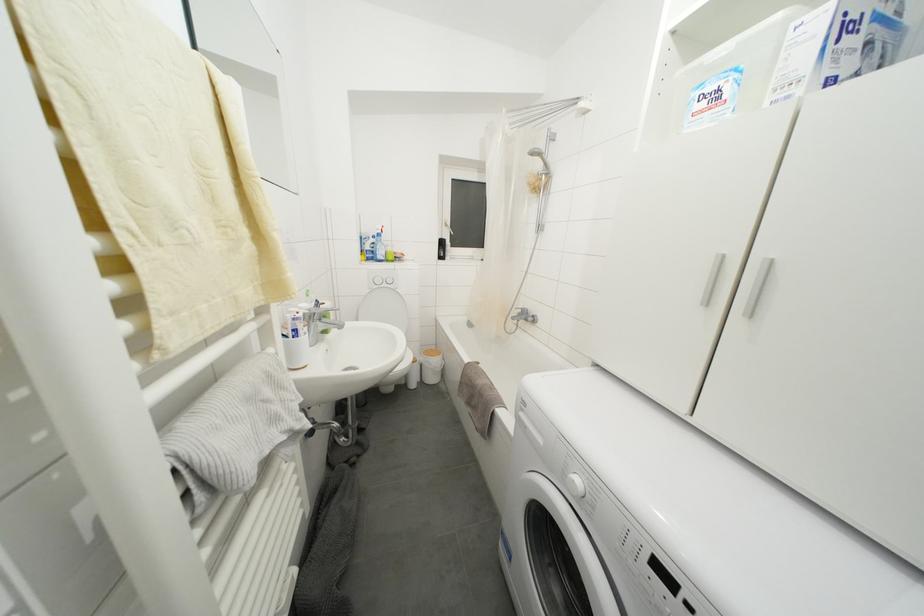
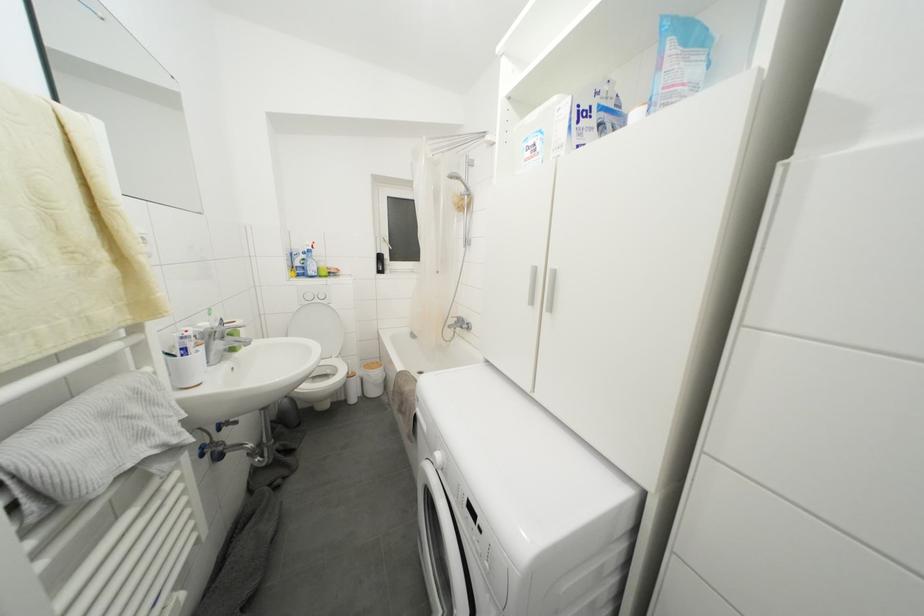
Find the pixel in the second image that matches point 543,159 in the first image.

(463, 182)